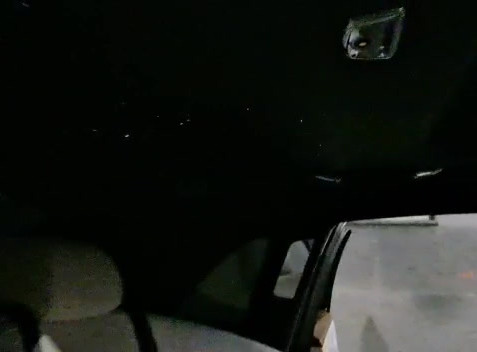
Locate an element on the screen. The width and height of the screenshot is (477, 352). frame is located at coordinates click(x=317, y=284), click(x=265, y=305).